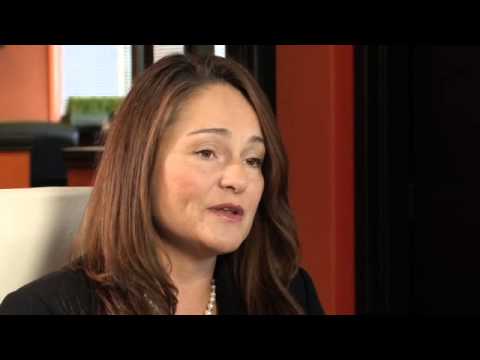
Where is `red moulding`? The width and height of the screenshot is (480, 360). red moulding is located at coordinates (326, 233), (322, 128), (317, 91).